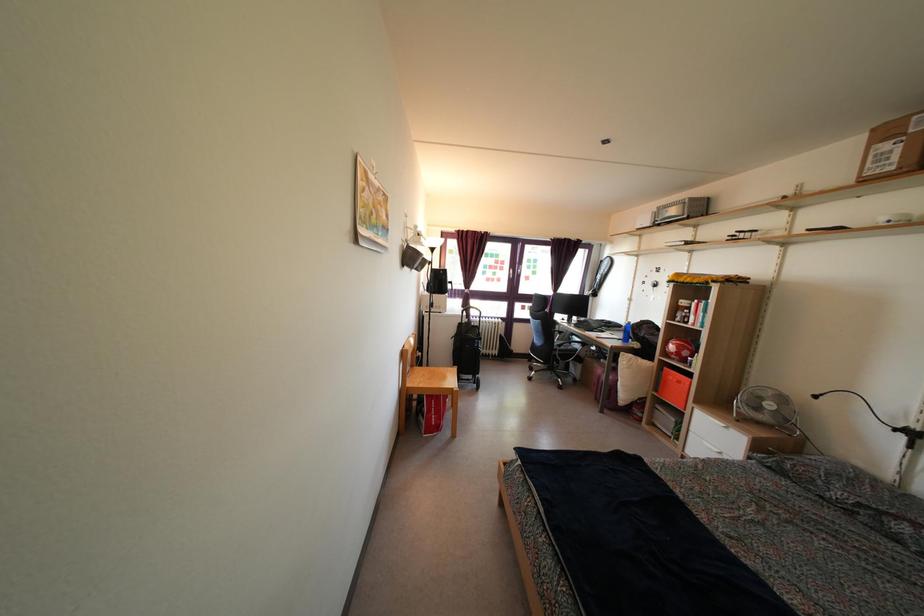
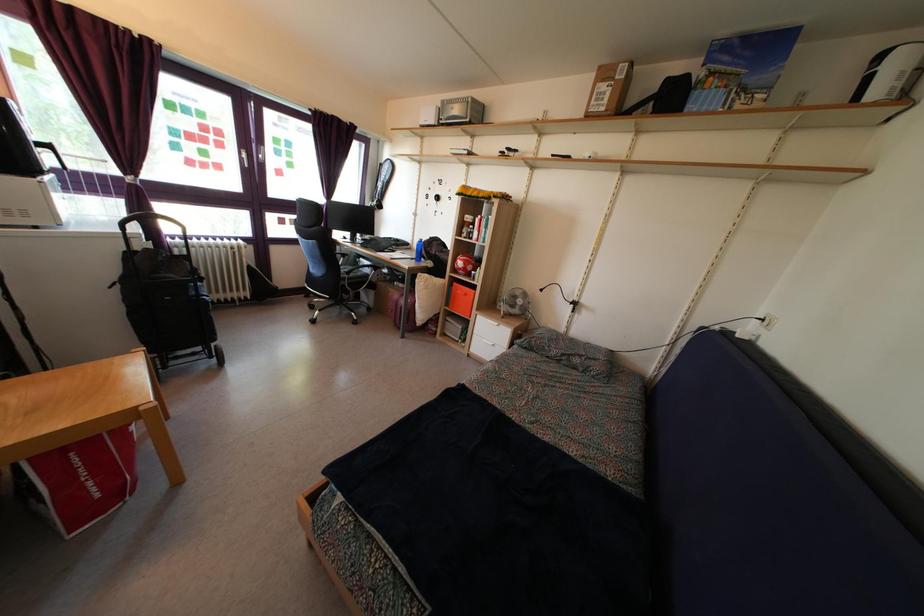
The point at [441,437] is marked in the first image. Where is the corresponding point in the second image?

(122, 501)